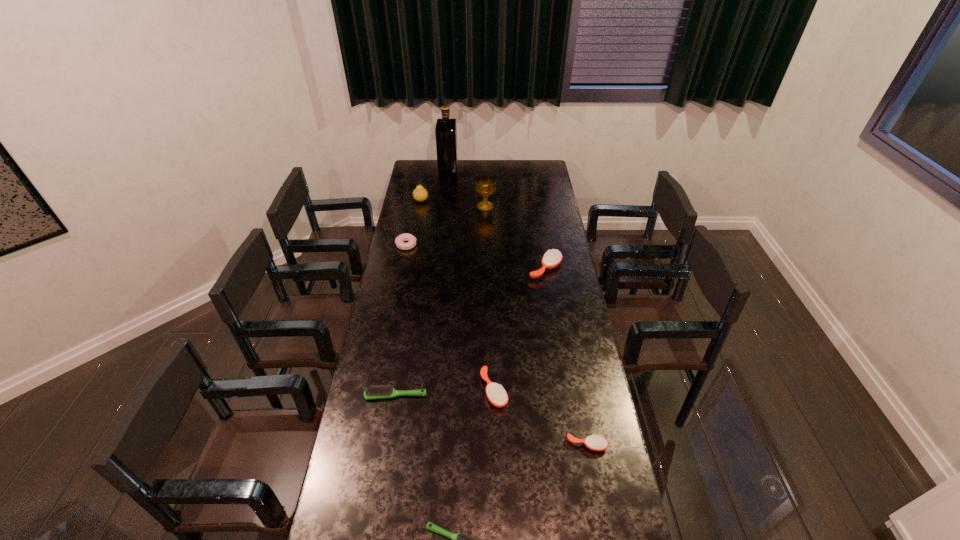
Find the location of a particular element. This screenshot has height=540, width=960. the left light hairbrush is located at coordinates (373, 392).

The width and height of the screenshot is (960, 540). I want to click on the bigger light hairbrush, so click(x=373, y=392).

The image size is (960, 540). What are the coordinates of `the fourth farthest hairbrush` in the screenshot? It's located at (594, 442).

This screenshot has width=960, height=540. In order to click on the eighth farthest object in this screenshot , I will do `click(594, 442)`.

Locate an element on the screen. This screenshot has width=960, height=540. vacant space situated 0.400m on the front label of the tallest object is located at coordinates (520, 168).

You are a GUI agent. You are given a task and a screenshot of the screen. Output one action in this format:
    pyautogui.click(x=<x>, y=<y>)
    Task: Click on the vacant area situated 0.200m on the back of the chalice
    This screenshot has height=540, width=960.
    Given the screenshot: What is the action you would take?
    [485, 183]

The height and width of the screenshot is (540, 960). Find the location of `free region located on the front of the seventh shortest object`. free region located on the front of the seventh shortest object is located at coordinates (414, 243).

Find the location of a particular element. This screenshot has height=540, width=960. free space located on the left of the fifth farthest object is located at coordinates (478, 268).

The width and height of the screenshot is (960, 540). I want to click on vacant space located 0.340m on the back of the second biggest orange hairbrush, so click(x=492, y=306).

Where is `free space located 0.370m on the right of the purple doughnut`? The width and height of the screenshot is (960, 540). free space located 0.370m on the right of the purple doughnut is located at coordinates (490, 245).